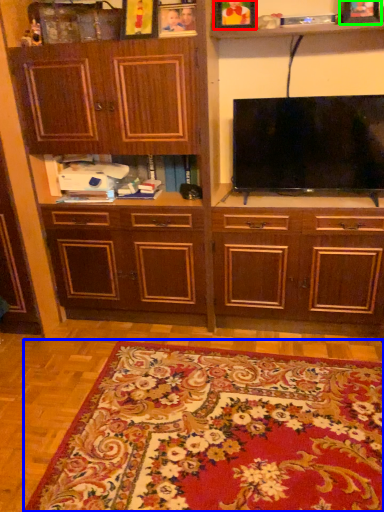
Question: Which is nearer to the picture frame (highlighted by a red box)? mat (highlighted by a blue box) or picture frame (highlighted by a green box).

Choices:
 (A) mat
 (B) picture frame

Answer: (B)